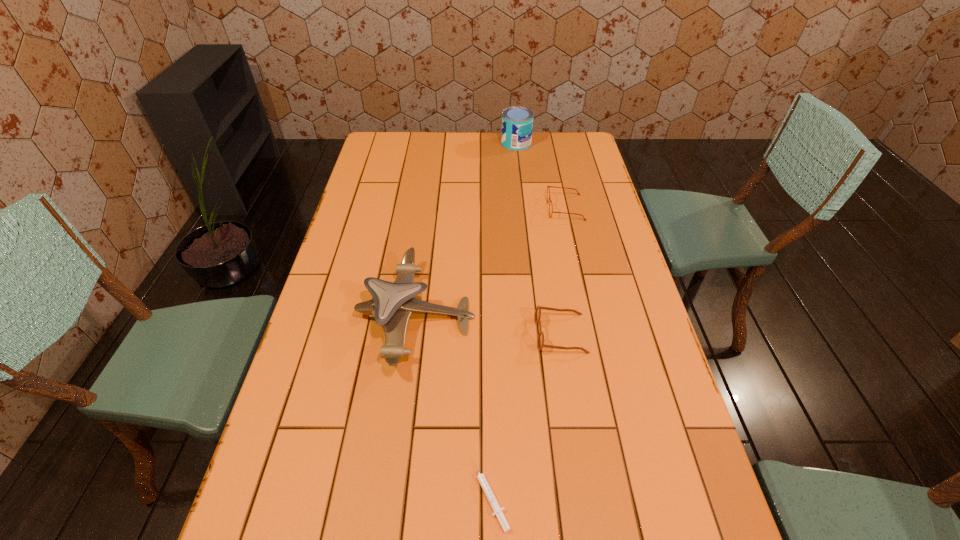
Identify the location of the tallest object. The width and height of the screenshot is (960, 540). (517, 122).

Where is `can`? can is located at coordinates (517, 122).

You are a GUI agent. You are given a task and a screenshot of the screen. Output one action in this format:
    pyautogui.click(x=<x>, y=<y>)
    Task: Click on the drone
    This screenshot has height=540, width=960.
    Given the screenshot: What is the action you would take?
    pyautogui.click(x=393, y=303)

Image resolution: width=960 pixels, height=540 pixels. In order to click on the second farthest object in this screenshot , I will do `click(547, 186)`.

Find the location of `the nearer spectacles`. the nearer spectacles is located at coordinates coord(540,341).

The height and width of the screenshot is (540, 960). I want to click on the nearest object, so click(497, 509).

At what (x,y) coordinates should I click in order to perform the action: click on syringe. Please return your answer as a coordinate pair (x, y). The image size is (960, 540). Looking at the image, I should click on (497, 509).

Find the location of a particular element. The width and height of the screenshot is (960, 540). vacant space located on the front of the tallest object is located at coordinates (518, 163).

Locate an element on the screen. The width and height of the screenshot is (960, 540). vacant point located on the front-facing side of the fourth shortest object is located at coordinates (605, 317).

Identify the location of free spot located 0.090m on the face of the farther spectacles. Image resolution: width=960 pixels, height=540 pixels. (523, 208).